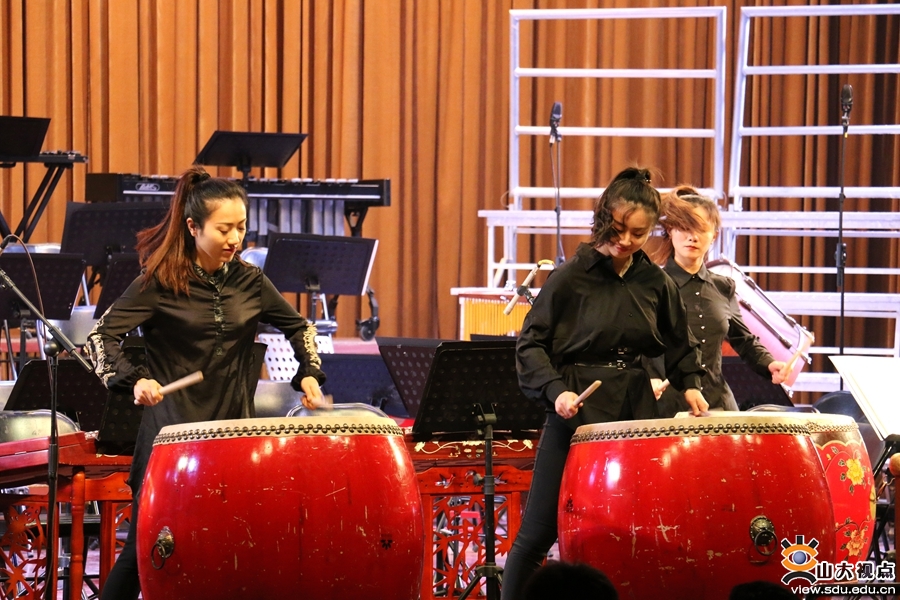
The image size is (900, 600). In order to click on burnt orange curtains in this screenshot , I will do `click(378, 20)`.